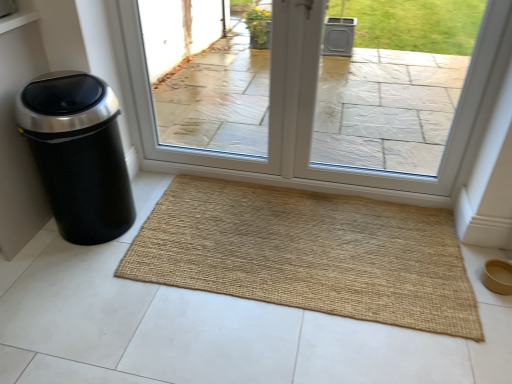
Where is `free space in front of black matte trash can at left`? This screenshot has height=384, width=512. free space in front of black matte trash can at left is located at coordinates (78, 275).